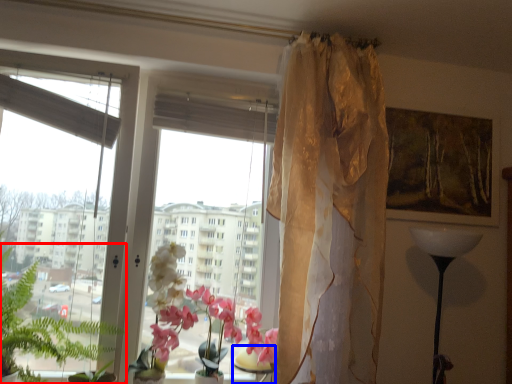
Question: Which object appears closest to the camera in this image, vegetation (highlighted by a red box) or table (highlighted by a blue box)?

Choices:
 (A) vegetation
 (B) table

Answer: (A)